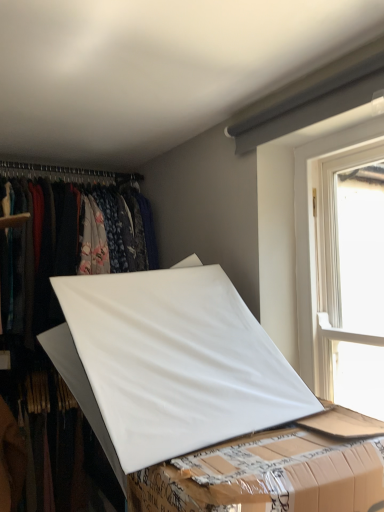
Question: Should I look upward or downward to see white plastic window at upper right?

Choices:
 (A) up
 (B) down

Answer: (A)

Question: Is white matte board at center facing away from white matte board at center?

Choices:
 (A) yes
 (B) no

Answer: (B)

Question: Is white matte board at center shorter than white matte board at center?

Choices:
 (A) yes
 (B) no

Answer: (A)

Question: Considering the relative sizes of white matte board at center and white matte board at center in the image provided, is white matte board at center wider than white matte board at center?

Choices:
 (A) yes
 (B) no

Answer: (A)

Question: Can white matte board at center be found inside white matte board at center?

Choices:
 (A) no
 (B) yes

Answer: (A)

Question: Can you confirm if white matte board at center is positioned to the right of white matte board at center?

Choices:
 (A) yes
 (B) no

Answer: (A)

Question: Can you confirm if white matte board at center is smaller than white matte board at center?

Choices:
 (A) no
 (B) yes

Answer: (B)

Question: Can you confirm if white matte board at center is shorter than white matte board at center?

Choices:
 (A) yes
 (B) no

Answer: (B)

Question: Is white matte board at center at the left side of white matte board at center?

Choices:
 (A) no
 (B) yes

Answer: (B)

Question: Are white matte board at center and white matte board at center far apart?

Choices:
 (A) yes
 (B) no

Answer: (B)

Question: Does white matte board at center have a larger size compared to white matte board at center?

Choices:
 (A) no
 (B) yes

Answer: (B)

Question: Can you confirm if white matte board at center is taller than white matte board at center?

Choices:
 (A) no
 (B) yes

Answer: (B)

Question: Could you tell me if white matte board at center is turned towards white matte board at center?

Choices:
 (A) no
 (B) yes

Answer: (B)

Question: Is white plastic window at upper right directly adjacent to white matte board at center?

Choices:
 (A) no
 (B) yes

Answer: (A)